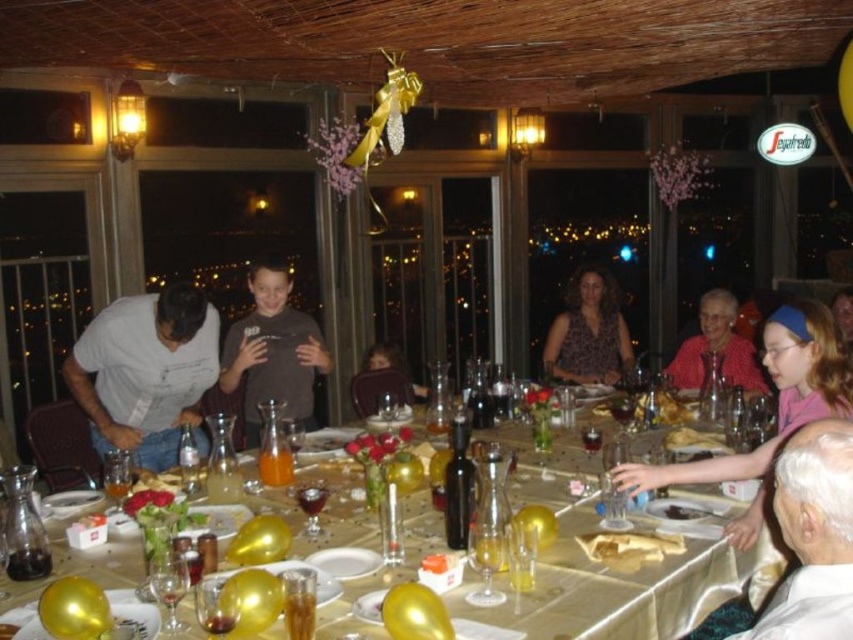
Question: Which object is the closest to the matte red blouse at right?

Choices:
 (A) matte brown sweater at center
 (B) white satin headscarf at upper right
 (C) matte brown shirt at center

Answer: (A)

Question: Is clear glass wine glass at lower left closer to camera compared to translucent glass wine glass at lower center?

Choices:
 (A) no
 (B) yes

Answer: (A)

Question: Among these objects, which one is farthest from the camera?

Choices:
 (A) matte gray shirt at left
 (B) translucent glass wine glass at lower center

Answer: (A)

Question: Which object is closer to the camera taking this photo?

Choices:
 (A) white satin headscarf at upper right
 (B) translucent glass wine glass at center

Answer: (A)

Question: Is gold satin tablecloth at center bigger than translucent glass wine glass at lower center?

Choices:
 (A) yes
 (B) no

Answer: (A)

Question: Is white satin headscarf at upper right above translucent glass wine glass at center?

Choices:
 (A) yes
 (B) no

Answer: (A)